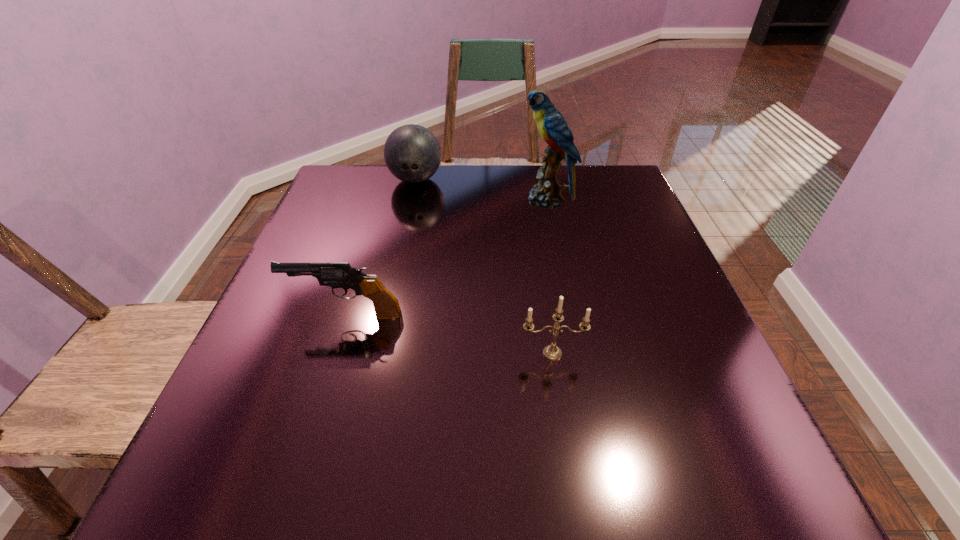
Locate an element on the screen. vacant region between the nearest object and the tallest object is located at coordinates (549, 276).

This screenshot has width=960, height=540. I want to click on empty space between the third farthest object and the bowling ball, so click(x=381, y=247).

Locate an element on the screen. free space between the parrot and the bowling ball is located at coordinates (481, 190).

Locate an element on the screen. unoccupied area between the tallest object and the gun is located at coordinates (446, 257).

Find the location of a particular element. Image resolution: width=960 pixels, height=540 pixels. free space between the nearest object and the second nearest object is located at coordinates (449, 334).

Where is `vacant area that lies between the tallest object and the gun`? The image size is (960, 540). vacant area that lies between the tallest object and the gun is located at coordinates (446, 257).

Identify the location of free area in between the candle and the bowling ball. (484, 266).

In order to click on empty space that is in between the third farthest object and the candle in this screenshot , I will do [x=449, y=334].

Image resolution: width=960 pixels, height=540 pixels. I want to click on vacant space that's between the third farthest object and the tallest object, so click(446, 257).

Where is `object that is the closest to the bowling ball`? object that is the closest to the bowling ball is located at coordinates (553, 128).